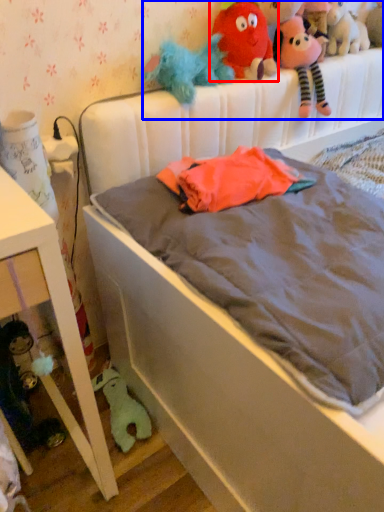
Question: Among these objects, which one is farthest to the camera, toy (highlighted by a red box) or stuff (highlighted by a blue box)?

Choices:
 (A) toy
 (B) stuff

Answer: (B)